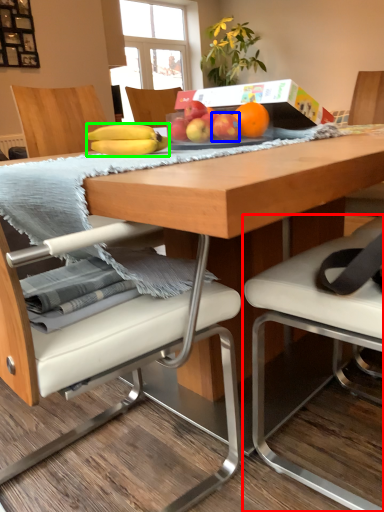
Question: Which object is the farthest from chair (highlighted by a red box)? Choose among these: apple (highlighted by a blue box) or banana (highlighted by a green box).

Choices:
 (A) apple
 (B) banana

Answer: (A)